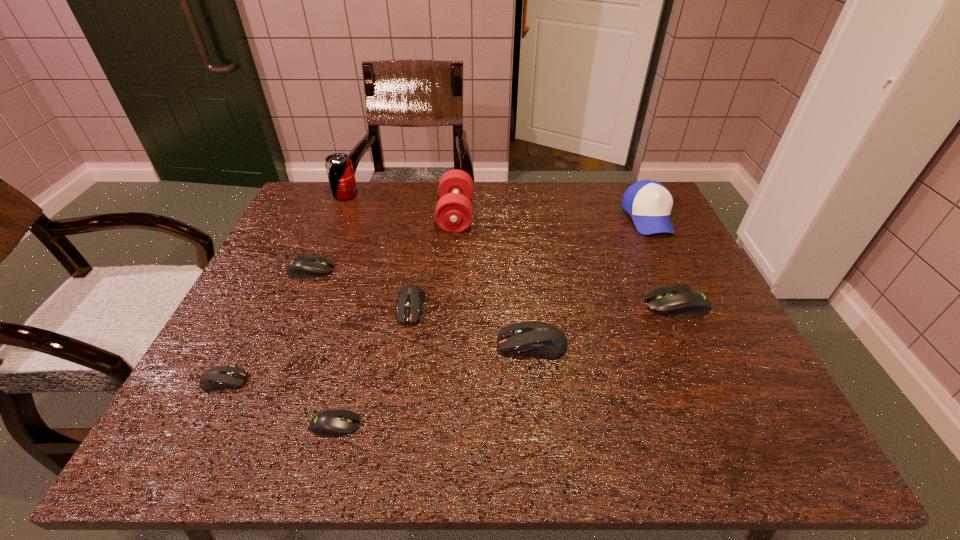
You are a GUI agent. You are given a task and a screenshot of the screen. Output one action in this format:
    pyautogui.click(x=<x>, y=<y>)
    Task: Click on the vacant space at the right edge of the desktop
    
    Given the screenshot: What is the action you would take?
    pyautogui.click(x=671, y=345)

I want to click on vacant space at the far left corner, so click(325, 220).

This screenshot has height=540, width=960. Identify the location of vacant region at the far right corner of the desktop. (630, 183).

Where is `vacant area that lies between the second smallest gray computer mouse and the biggest gray computer mouse`? The width and height of the screenshot is (960, 540). vacant area that lies between the second smallest gray computer mouse and the biggest gray computer mouse is located at coordinates (493, 287).

At what (x,y) coordinates should I click in order to perform the action: click on vacant point located between the second smallest gray computer mouse and the rightmost computer mouse. Please return your answer as a coordinate pair (x, y). This screenshot has width=960, height=540. Looking at the image, I should click on (493, 287).

Where is `empty space between the rightmost computer mouse and the white baseball cap`? The image size is (960, 540). empty space between the rightmost computer mouse and the white baseball cap is located at coordinates (662, 261).

Where is `vacant space that is in between the fourth computer mouse from right to left and the fourth object from right to left`? This screenshot has width=960, height=540. vacant space that is in between the fourth computer mouse from right to left and the fourth object from right to left is located at coordinates (396, 320).

Where is `unoccupied position between the second dark computer equipment from right to left and the fourth object from right to left`? unoccupied position between the second dark computer equipment from right to left and the fourth object from right to left is located at coordinates (433, 261).

Locate an element on the screen. The width and height of the screenshot is (960, 540). vacant space that is in between the tallest object and the white baseball cap is located at coordinates (496, 206).

Find the location of a particular element. This screenshot has width=960, height=540. vacant region between the sixth object from left to right and the rightmost computer mouse is located at coordinates (566, 260).